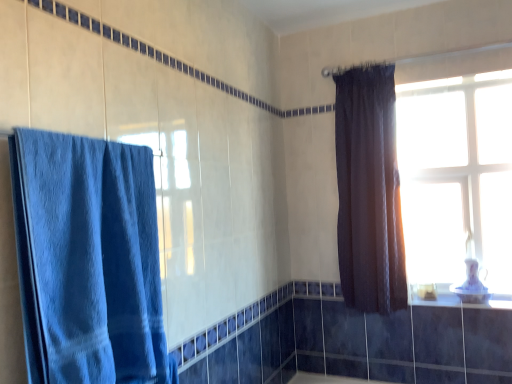
What do you see at coordinates (88, 260) in the screenshot?
I see `blue towel at left, acting as the second curtain starting from the right` at bounding box center [88, 260].

Find the location of `white glossy sink at upper right`. white glossy sink at upper right is located at coordinates (471, 285).

You are a GUI agent. You are given a task and a screenshot of the screen. Output one action in this format:
    pyautogui.click(x=<x>, y=<y>)
    Task: Click on the porcelain white window sill at lower right
    The width and height of the screenshot is (512, 384).
    Given the screenshot: What is the action you would take?
    pyautogui.click(x=464, y=302)

From the image's perspective, which is below, porcelain white window sill at lower right or dark matte curtain at upper right, placed as the first curtain when sorted from back to front?

porcelain white window sill at lower right is shown below in the image.

Can you tell me how much porcelain white window sill at lower right and dark matte curtain at upper right, which is counted as the second curtain, starting from the left, differ in facing direction?

The angular difference between porcelain white window sill at lower right and dark matte curtain at upper right, which is counted as the second curtain, starting from the left, is 0.851 degrees.

Is porcelain white window sill at lower right next to dark matte curtain at upper right, which is counted as the second curtain, starting from the left, and touching it?

No, porcelain white window sill at lower right is not with dark matte curtain at upper right, which is counted as the second curtain, starting from the left.

From a real-world perspective, is porcelain white window sill at lower right physically located above or below dark matte curtain at upper right, placed as the first curtain when sorted from back to front?

In terms of real-world spatial position, porcelain white window sill at lower right is below dark matte curtain at upper right, placed as the first curtain when sorted from back to front.

Consider the image. Which is nearer, (498,301) or (26,344)?

Point (498,301) is farther from the camera than point (26,344).

Considering the relative sizes of porcelain white window sill at lower right and blue towel at left, arranged as the second curtain when viewed from the back, in the image provided, is porcelain white window sill at lower right wider than blue towel at left, arranged as the second curtain when viewed from the back,?

Indeed, porcelain white window sill at lower right has a greater width compared to blue towel at left, arranged as the second curtain when viewed from the back.

Is porcelain white window sill at lower right inside the boundaries of blue towel at left, the 1th curtain from the left, or outside?

porcelain white window sill at lower right is not enclosed by blue towel at left, the 1th curtain from the left.

Can dark matte curtain at upper right, which is counted as the second curtain, starting from the left, be found inside blue towel at left, the 1th curtain from the left?

That's incorrect, dark matte curtain at upper right, which is counted as the second curtain, starting from the left, is not inside blue towel at left, the 1th curtain from the left.

Does blue towel at left, the first curtain when ordered from front to back, touch dark matte curtain at upper right, placed as the first curtain when sorted from back to front?

No, blue towel at left, the first curtain when ordered from front to back, is not making contact with dark matte curtain at upper right, placed as the first curtain when sorted from back to front.

From the image's perspective, which is above, blue towel at left, the 1th curtain from the left, or dark matte curtain at upper right, which is counted as the 1th curtain, starting from the right?

dark matte curtain at upper right, which is counted as the 1th curtain, starting from the right.

Looking at this image, which object is closer to the camera, blue towel at left, arranged as the second curtain when viewed from the back, or dark matte curtain at upper right, which is counted as the 2th curtain, starting from the front?

blue towel at left, arranged as the second curtain when viewed from the back.

Measure the distance between blue towel at left, the 1th curtain from the left, and white glossy sink at upper right.

6.35 feet.

Identify the location of curtain that is the 1st object above the white glossy sink at upper right (from a real-world perspective). This screenshot has width=512, height=384. (88, 260).

Is blue towel at left, the 1th curtain from the left, spatially inside white glossy sink at upper right, or outside of it?

blue towel at left, the 1th curtain from the left, is located beyond the bounds of white glossy sink at upper right.

Which of these two, blue towel at left, acting as the second curtain starting from the right, or white glossy sink at upper right, is smaller?

With smaller size is white glossy sink at upper right.

Is transparent glass window at upper right turned away from blue towel at left, the first curtain when ordered from front to back?

No, transparent glass window at upper right's orientation is not away from blue towel at left, the first curtain when ordered from front to back.

Can we say transparent glass window at upper right lies outside blue towel at left, arranged as the second curtain when viewed from the back?

transparent glass window at upper right is positioned outside blue towel at left, arranged as the second curtain when viewed from the back.

Would you consider transparent glass window at upper right to be distant from blue towel at left, the 1th curtain from the left?

Absolutely, transparent glass window at upper right is distant from blue towel at left, the 1th curtain from the left.

Can you tell me how much blue towel at left, the 1th curtain from the left, and transparent glass window at upper right differ in facing direction?

The angle between the facing direction of blue towel at left, the 1th curtain from the left, and the facing direction of transparent glass window at upper right is 90.5 degrees.

From a real-world perspective, which is physically above, blue towel at left, the first curtain when ordered from front to back, or transparent glass window at upper right?

transparent glass window at upper right, from a real-world perspective.

Which of these two, blue towel at left, arranged as the second curtain when viewed from the back, or transparent glass window at upper right, is bigger?

blue towel at left, arranged as the second curtain when viewed from the back, is bigger.

Which of these two, blue towel at left, the 1th curtain from the left, or transparent glass window at upper right, is wider?

With larger width is blue towel at left, the 1th curtain from the left.

From a real-world perspective, which object rests below the other?

porcelain white window sill at lower right is physically lower.

Relative to porcelain white window sill at lower right, is white glossy sink at upper right in front or behind?

In the image, white glossy sink at upper right appears behind porcelain white window sill at lower right.

This screenshot has height=384, width=512. Identify the location of window sill in front of the white glossy sink at upper right. (464, 302).

Considering the positions of point (479, 287) and point (452, 304), is point (479, 287) closer or farther from the camera than point (452, 304)?

Point (479, 287) appears to be farther away from the viewer than point (452, 304).

Identify the location of window sill below the dark matte curtain at upper right, placed as the first curtain when sorted from back to front (from the image's perspective). (464, 302).

The image size is (512, 384). I want to click on curtain in front of the porcelain white window sill at lower right, so click(x=88, y=260).

Based on their spatial positions, is transparent glass window at upper right or blue towel at left, acting as the second curtain starting from the right, further from dark matte curtain at upper right, which is counted as the second curtain, starting from the left?

Based on the image, blue towel at left, acting as the second curtain starting from the right, appears to be further to dark matte curtain at upper right, which is counted as the second curtain, starting from the left.

Based on their spatial positions, is porcelain white window sill at lower right or white glossy sink at upper right further from dark matte curtain at upper right, which is counted as the 2th curtain, starting from the front?

white glossy sink at upper right.

From the image, which object appears to be nearer to porcelain white window sill at lower right, blue towel at left, the first curtain when ordered from front to back, or white glossy sink at upper right?

The object closer to porcelain white window sill at lower right is white glossy sink at upper right.

Based on their spatial positions, is white glossy sink at upper right or blue towel at left, arranged as the second curtain when viewed from the back, further from porcelain white window sill at lower right?

The object further to porcelain white window sill at lower right is blue towel at left, arranged as the second curtain when viewed from the back.

Considering their positions, is dark matte curtain at upper right, which is counted as the 2th curtain, starting from the front, positioned closer to transparent glass window at upper right than white glossy sink at upper right?

dark matte curtain at upper right, which is counted as the 2th curtain, starting from the front, is closer to transparent glass window at upper right.

Considering their positions, is white glossy sink at upper right positioned further to dark matte curtain at upper right, which is counted as the 2th curtain, starting from the front, than blue towel at left, the 1th curtain from the left?

blue towel at left, the 1th curtain from the left, is positioned further to the anchor dark matte curtain at upper right, which is counted as the 2th curtain, starting from the front.

Estimate the real-world distances between objects in this image. Which object is further from transparent glass window at upper right, white glossy sink at upper right or dark matte curtain at upper right, placed as the first curtain when sorted from back to front?

Based on the image, white glossy sink at upper right appears to be further to transparent glass window at upper right.

Estimate the real-world distances between objects in this image. Which object is closer to white glossy sink at upper right, transparent glass window at upper right or dark matte curtain at upper right, which is counted as the second curtain, starting from the left?

Among the two, transparent glass window at upper right is located nearer to white glossy sink at upper right.

The image size is (512, 384). I want to click on window sill between dark matte curtain at upper right, placed as the first curtain when sorted from back to front, and white glossy sink at upper right from left to right, so click(464, 302).

At what (x,y) coordinates should I click in order to perform the action: click on curtain between blue towel at left, acting as the second curtain starting from the right, and white glossy sink at upper right in the front-back direction. Please return your answer as a coordinate pair (x, y). Looking at the image, I should click on (369, 191).

Image resolution: width=512 pixels, height=384 pixels. What are the coordinates of `window located between dark matte curtain at upper right, which is counted as the second curtain, starting from the left, and white glossy sink at upper right in the left-right direction` in the screenshot? It's located at (456, 164).

Image resolution: width=512 pixels, height=384 pixels. I want to click on window sill between blue towel at left, acting as the second curtain starting from the right, and transparent glass window at upper right from left to right, so click(464, 302).